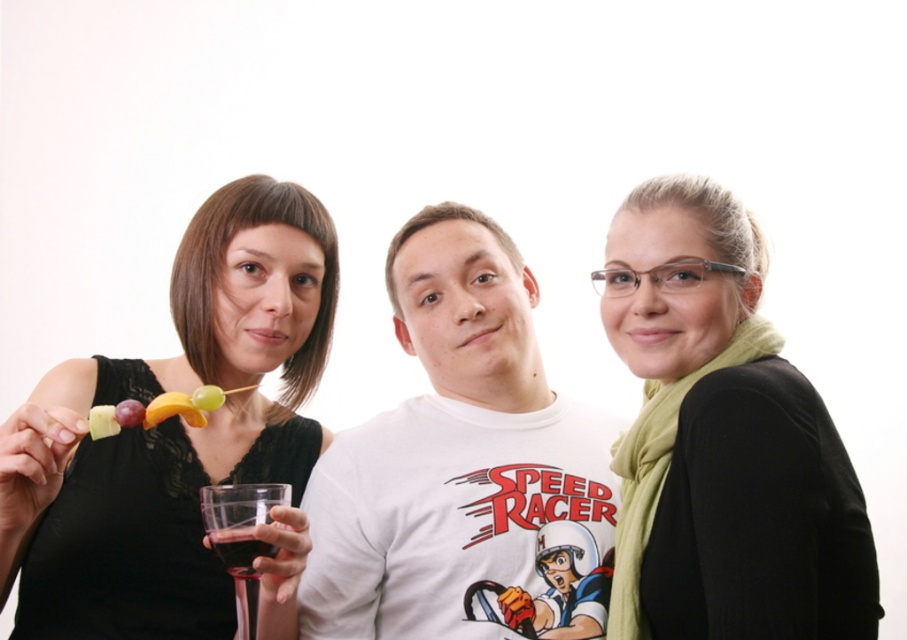
You are standing in front of the three people in the image. Which of the two points, point (x=112, y=429) or point (x=120, y=419), is closer to you?

Point (x=112, y=429) is closer to the viewer than point (x=120, y=419).

You are a photographer standing 36.57 inches away from the yellow matte pineapple at center. You want to take a photo of the pineapple and ensure it fills the frame. Would you need to zoom in or out?

Since the yellow matte pineapple at center and the camera are 36.57 inches apart, you would need to zoom in to ensure the pineapple fills the frame.

You are organizing a charity event and need to arrange items on a narrow shelf. You have the black lace dress at upper left and the yellow matte pineapple at center. Based on their widths, which item should you place first to ensure they both fit?

The black lace dress at upper left might be wider than the yellow matte pineapple at center, so you should place the narrower item, the yellow matte pineapple at center, first to maximize space for the wider dress.